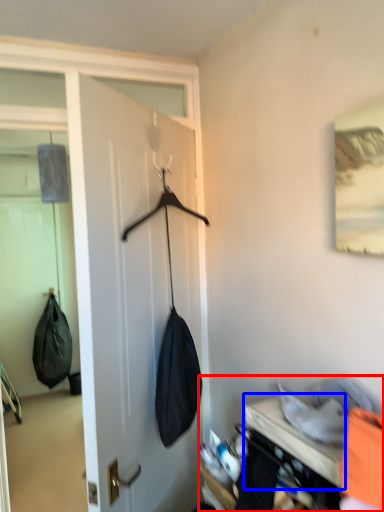
Question: Which point is closer to the camera, closet (highlighted by a red box) or furniture (highlighted by a blue box)?

Choices:
 (A) closet
 (B) furniture

Answer: (A)